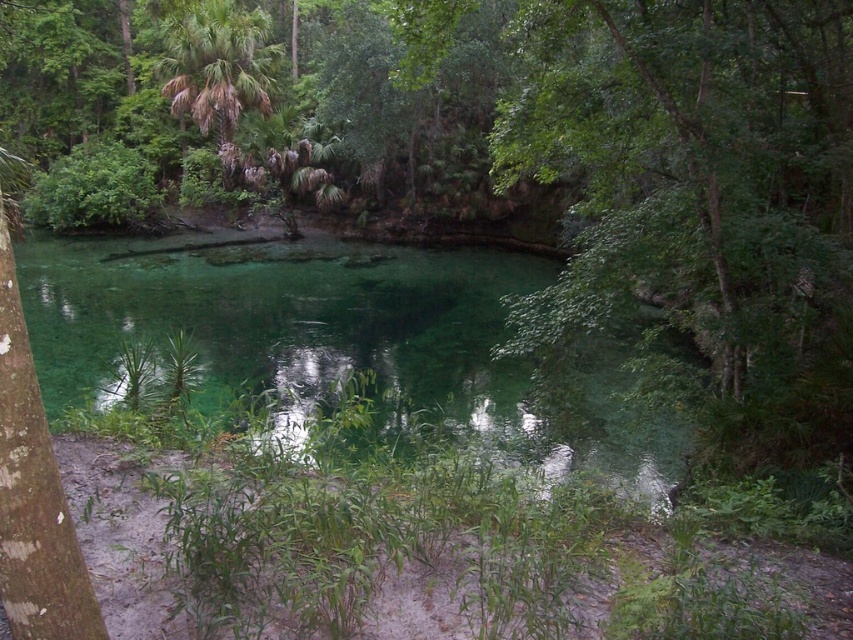
Question: Is green translucent water at center thinner than green leafy palm tree at upper left?

Choices:
 (A) no
 (B) yes

Answer: (A)

Question: Which of the following is the closest to the observer?

Choices:
 (A) green translucent water at center
 (B) green leafy palm tree at upper left

Answer: (A)

Question: Can you confirm if green translucent water at center is wider than green leafy palm tree at upper left?

Choices:
 (A) no
 (B) yes

Answer: (B)

Question: Which of the following is the closest to the observer?

Choices:
 (A) (213, 97)
 (B) (42, 253)

Answer: (B)

Question: Which of the following is the farthest from the observer?

Choices:
 (A) green leafy palm tree at upper left
 (B) green translucent water at center

Answer: (A)

Question: Where is green translucent water at center located in relation to green leafy palm tree at upper left in the image?

Choices:
 (A) right
 (B) left

Answer: (A)